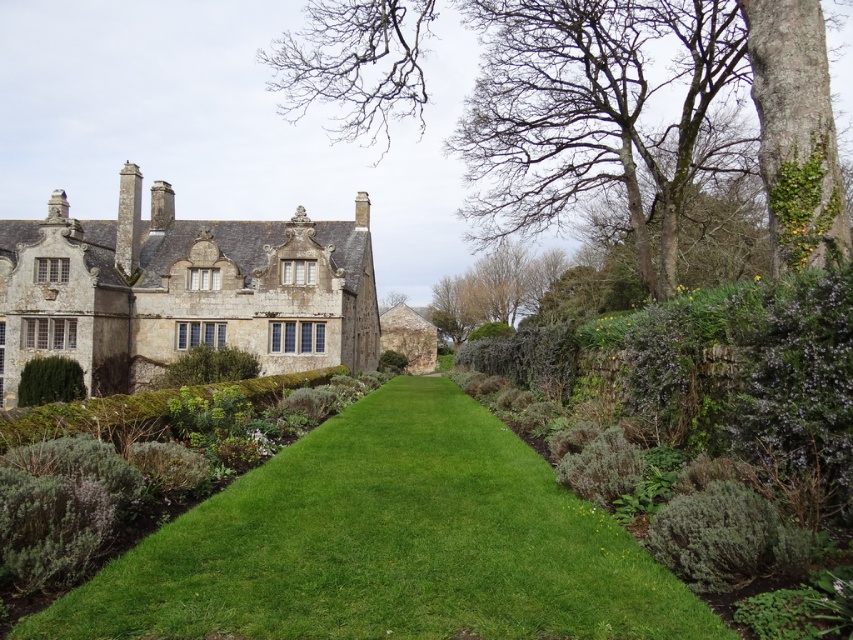
Is green leafy tree at center shorter than green leafy hedge at center?

No, green leafy tree at center is not shorter than green leafy hedge at center.

Is green leafy tree at center wider than green leafy hedge at center?

Correct, the width of green leafy tree at center exceeds that of green leafy hedge at center.

Which is in front, point (509, 278) or point (170, 369)?

Point (170, 369)

Where is `green leafy tree at center`? green leafy tree at center is located at coordinates (492, 289).

Which is above, green grass at center or green leafy hedge at center?

green leafy hedge at center is above.

Does point (587, 572) come farther from viewer compared to point (163, 381)?

That is False.

What do you see at coordinates (387, 545) in the screenshot?
I see `green grass at center` at bounding box center [387, 545].

Locate an element on the screen. This screenshot has width=853, height=640. green grass at center is located at coordinates (387, 545).

Does point (758, 26) come farther from viewer compared to point (254, 368)?

No.

Where is `bare wood tree at upper center`? The image size is (853, 640). bare wood tree at upper center is located at coordinates (357, 65).